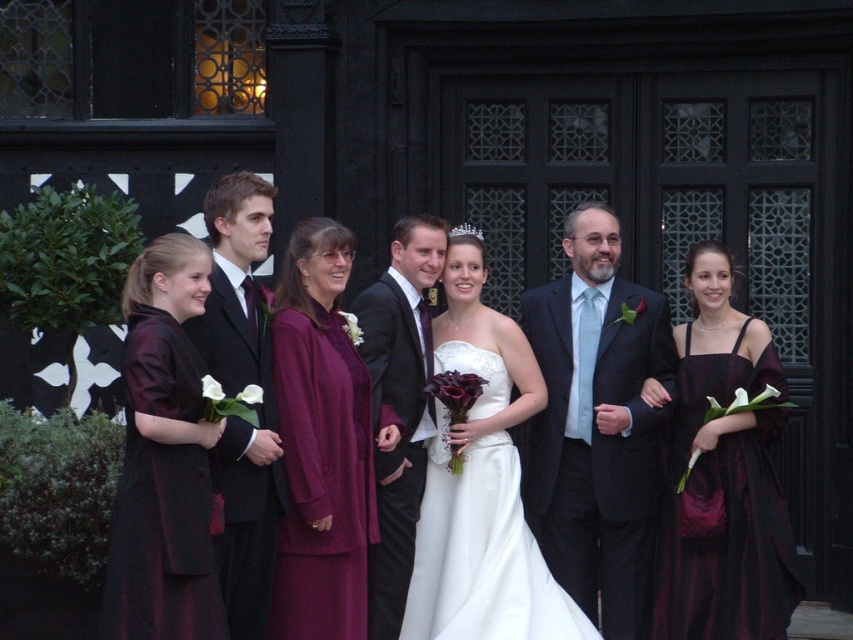
Between white satin dress at center and velvet burgundy dress at left, which one appears on the right side from the viewer's perspective?

From the viewer's perspective, white satin dress at center appears more on the right side.

Can you confirm if white satin dress at center is positioned below velvet burgundy dress at left?

Actually, white satin dress at center is above velvet burgundy dress at left.

This screenshot has width=853, height=640. In order to click on white satin dress at center in this screenshot , I will do `click(480, 483)`.

This screenshot has height=640, width=853. What are the coordinates of `white satin dress at center` in the screenshot? It's located at (480, 483).

Is burgundy satin dress at center positioned before shiny black suit at center?

That is True.

Is burgundy satin dress at center bigger than shiny black suit at center?

Indeed, burgundy satin dress at center has a larger size compared to shiny black suit at center.

Does point (775, 349) come farther from viewer compared to point (444, 230)?

No.

Find the location of a particular element. This screenshot has width=853, height=640. burgundy satin dress at center is located at coordinates (641, 456).

Does matte black suit at center appear under velvet burgundy dress at left?

No.

Who is more forward, (579,211) or (196,593)?

Point (196,593) is in front.

What are the coordinates of `matte black suit at center` in the screenshot? It's located at (596, 426).